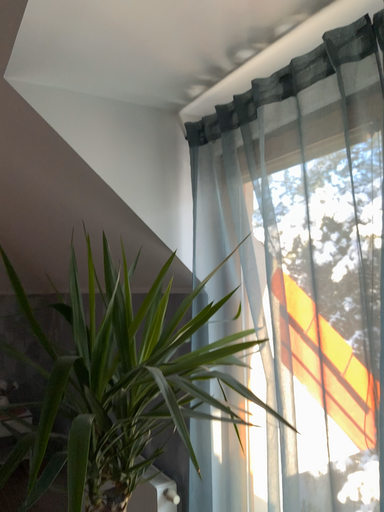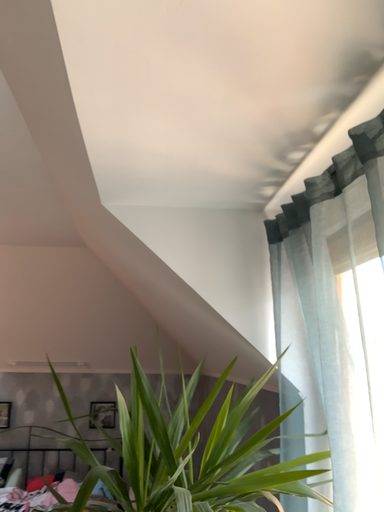
Question: Which way did the camera rotate in the video?

Choices:
 (A) rotated upward
 (B) rotated downward

Answer: (A)